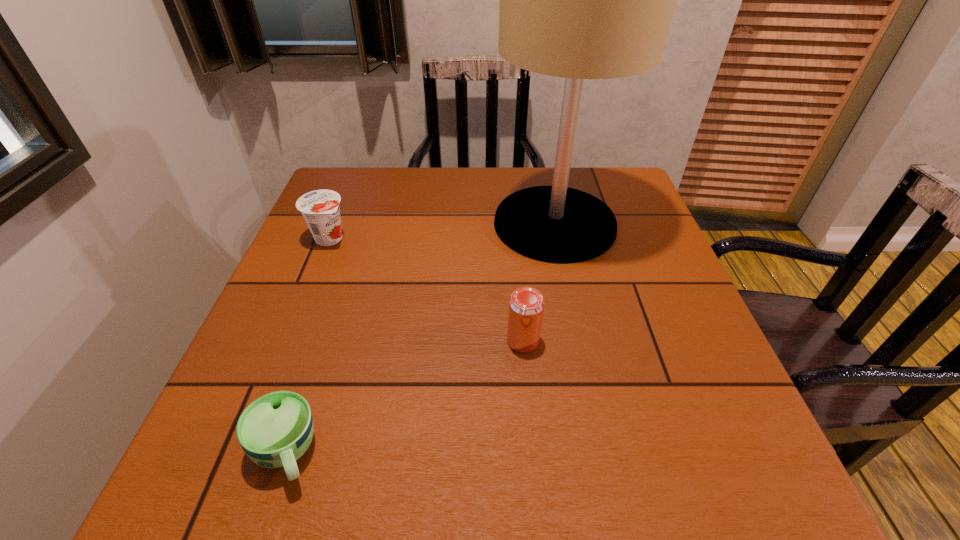
You are a GUI agent. You are given a task and a screenshot of the screen. Output one action in this format:
    pyautogui.click(x=<x>, y=<y>)
    Task: Click on the object that is at the near edge
    Image resolution: width=960 pixels, height=540 pixels.
    Given the screenshot: What is the action you would take?
    pyautogui.click(x=276, y=429)

Where is `yogurt located in the left edge section of the desktop`? yogurt located in the left edge section of the desktop is located at coordinates (320, 208).

This screenshot has height=540, width=960. What are the coordinates of `cup present at the left edge` in the screenshot? It's located at (276, 429).

Where is `object that is positioned at the right edge`? object that is positioned at the right edge is located at coordinates (580, 0).

The width and height of the screenshot is (960, 540). What are the coordinates of `object positioned at the near left corner` in the screenshot? It's located at (276, 429).

Locate an element on the screen. The width and height of the screenshot is (960, 540). object present at the far right corner is located at coordinates (580, 0).

The height and width of the screenshot is (540, 960). Find the location of `free space at the far edge of the desktop`. free space at the far edge of the desktop is located at coordinates (472, 177).

In the image, there is a desktop. Identify the location of vacant space at the near edge. (586, 475).

The width and height of the screenshot is (960, 540). Find the location of `vacant space at the left edge`. vacant space at the left edge is located at coordinates (327, 308).

Where is `free space at the right edge of the desktop`? free space at the right edge of the desktop is located at coordinates (674, 331).